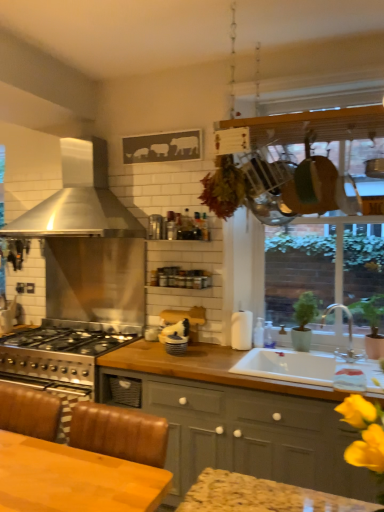
Question: Is white glossy jar at center, marked as the 1th appliance in a bottom-to-top arrangement, wider than matte gray cabinets at center?

Choices:
 (A) yes
 (B) no

Answer: (B)

Question: From a real-world perspective, is white glossy jar at center, the 2th appliance in the right-to-left sequence, on top of matte gray cabinets at center?

Choices:
 (A) no
 (B) yes

Answer: (B)

Question: Does white glossy jar at center, which is the 3th appliance in top-to-bottom order, contain matte gray cabinets at center?

Choices:
 (A) no
 (B) yes

Answer: (A)

Question: From the image's perspective, does white glossy jar at center, the 2th appliance in the right-to-left sequence, appear lower than matte gray cabinets at center?

Choices:
 (A) no
 (B) yes

Answer: (A)

Question: Can you confirm if white glossy jar at center, which is the second appliance from left to right, is positioned to the left of matte gray cabinets at center?

Choices:
 (A) no
 (B) yes

Answer: (B)

Question: In terms of height, does green matte plant at sink, the first plant viewed from the left, look taller or shorter compared to metallic silver spice rack at upper center, which is the first appliance in back-to-front order?

Choices:
 (A) tall
 (B) short

Answer: (A)

Question: Is green matte plant at sink, the first plant viewed from the left, wider or thinner than metallic silver spice rack at upper center, the third appliance when ordered from front to back?

Choices:
 (A) thin
 (B) wide

Answer: (B)

Question: From a real-world perspective, is green matte plant at sink, the first plant viewed from the left, positioned above or below metallic silver spice rack at upper center, arranged as the 1th appliance when viewed from the top?

Choices:
 (A) below
 (B) above

Answer: (A)

Question: Would you say green matte plant at sink, the first plant viewed from the left, is inside or outside metallic silver spice rack at upper center, the third appliance when ordered from front to back?

Choices:
 (A) inside
 (B) outside

Answer: (B)

Question: From a real-world perspective, is wooden frame at upper right physically located above or below white ceramic sink at lower right?

Choices:
 (A) below
 (B) above

Answer: (B)

Question: From the image's perspective, relative to white ceramic sink at lower right, is wooden frame at upper right above or below?

Choices:
 (A) below
 (B) above

Answer: (B)

Question: Based on their sizes in the image, would you say wooden frame at upper right is bigger or smaller than white ceramic sink at lower right?

Choices:
 (A) small
 (B) big

Answer: (B)

Question: In terms of width, does wooden frame at upper right look wider or thinner when compared to white ceramic sink at lower right?

Choices:
 (A) thin
 (B) wide

Answer: (A)

Question: Considering the positions of wooden frame at upper right and silver metallic faucet at sink right in the image, is wooden frame at upper right bigger or smaller than silver metallic faucet at sink right?

Choices:
 (A) big
 (B) small

Answer: (A)

Question: In terms of width, does wooden frame at upper right look wider or thinner when compared to silver metallic faucet at sink right?

Choices:
 (A) thin
 (B) wide

Answer: (B)